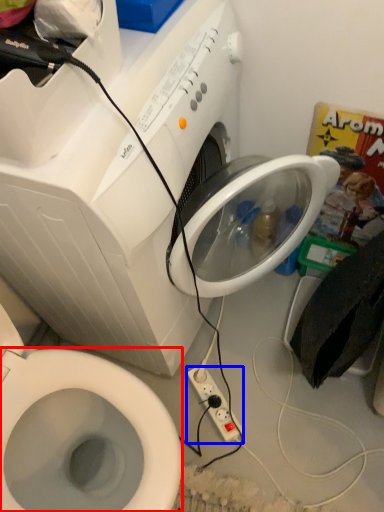
Question: Which object is closer to the camera taking this photo, bidet (highlighted by a red box) or power plugs and sockets (highlighted by a blue box)?

Choices:
 (A) bidet
 (B) power plugs and sockets

Answer: (A)